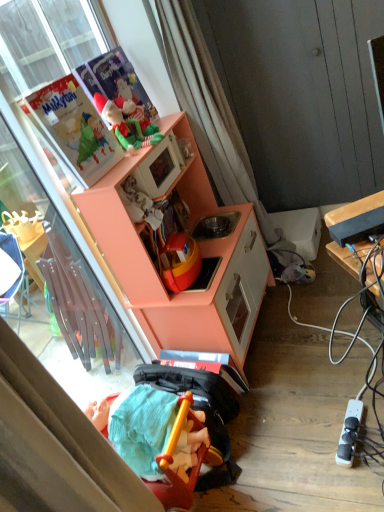
This screenshot has height=512, width=384. Find the location of `vacant space in front of white plastic power outlet at lower right`. vacant space in front of white plastic power outlet at lower right is located at coordinates (358, 472).